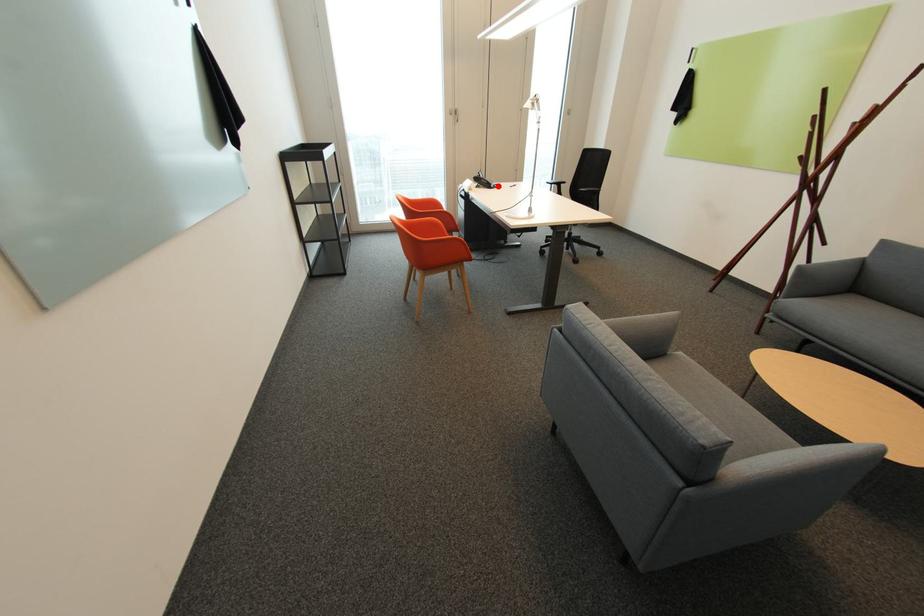
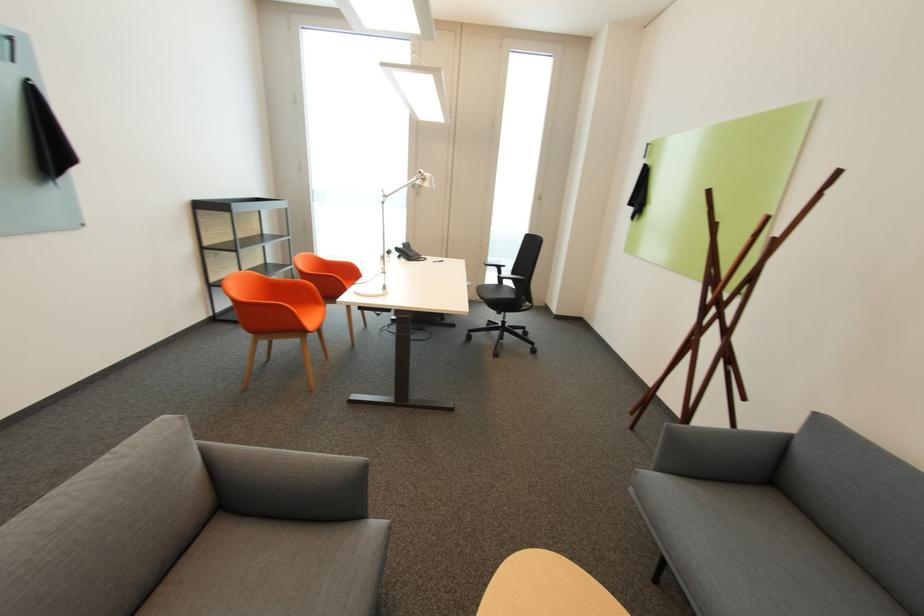
Where in the second image is the point corresponding to the highlighted location from the first image?

(419, 259)